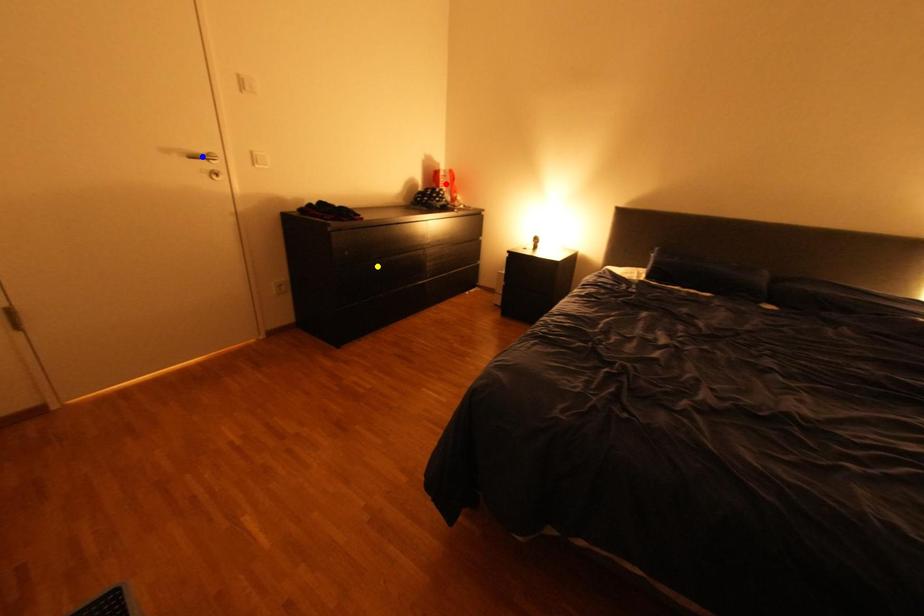
Order these from nearest to farthest:
A) blue point
B) yellow point
C) red point

blue point, yellow point, red point